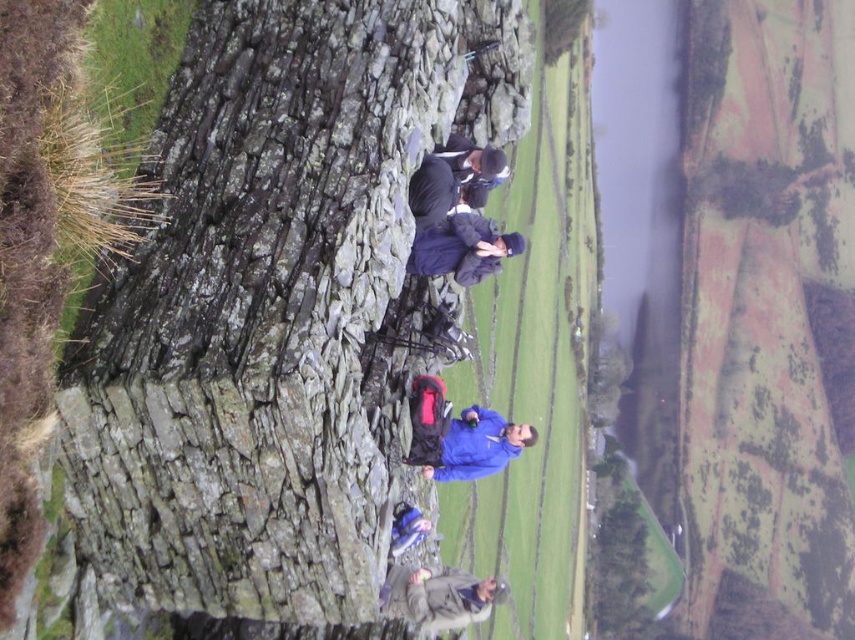
Question: Is rough stone wall at center above dark gray jacket at lower center?

Choices:
 (A) yes
 (B) no

Answer: (A)

Question: Estimate the real-world distances between objects in this image. Which object is farther from the rough stone wall at center?

Choices:
 (A) dark blue down jacket at center
 (B) dark gray jacket at lower center

Answer: (B)

Question: Is rough stone wall at center to the left of dark blue down jacket at center from the viewer's perspective?

Choices:
 (A) yes
 (B) no

Answer: (A)

Question: Which object appears closest to the camera in this image?

Choices:
 (A) dark blue down jacket at center
 (B) dark gray jacket at lower center

Answer: (A)

Question: Considering the relative positions of rough stone wall at center and dark gray jacket at lower center in the image provided, where is rough stone wall at center located with respect to dark gray jacket at lower center?

Choices:
 (A) right
 (B) left

Answer: (B)

Question: Which point is farther to the camera?

Choices:
 (A) rough stone wall at center
 (B) dark blue down jacket at center

Answer: (B)